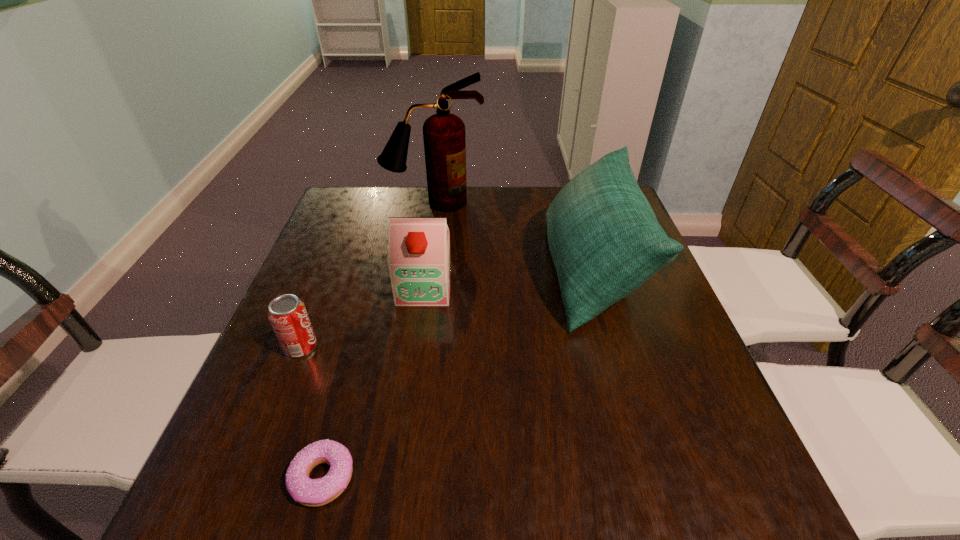
Identify the location of the tallest object. (444, 138).

The width and height of the screenshot is (960, 540). Find the location of `fire extinguisher`. fire extinguisher is located at coordinates (444, 138).

You are a GUI agent. You are given a task and a screenshot of the screen. Output one action in this format:
    pyautogui.click(x=<x>, y=<y>)
    Task: Click on the second tallest object
    Image resolution: width=960 pixels, height=540 pixels.
    Given the screenshot: What is the action you would take?
    pyautogui.click(x=605, y=241)

In order to click on cushion in this screenshot , I will do `click(605, 241)`.

Locate an element on the screen. The image size is (960, 540). soya milk is located at coordinates (419, 260).

The height and width of the screenshot is (540, 960). I want to click on the fourth tallest object, so click(289, 319).

The image size is (960, 540). Find the location of `soda can`. soda can is located at coordinates (289, 319).

This screenshot has width=960, height=540. Identify the location of the nearest object. (310, 492).

Identify the location of doughnut. This screenshot has height=540, width=960. (310, 492).

Find the location of a particular element. The height and width of the screenshot is (540, 960). free space located 0.100m at the nozzle of the farthest object is located at coordinates (429, 232).